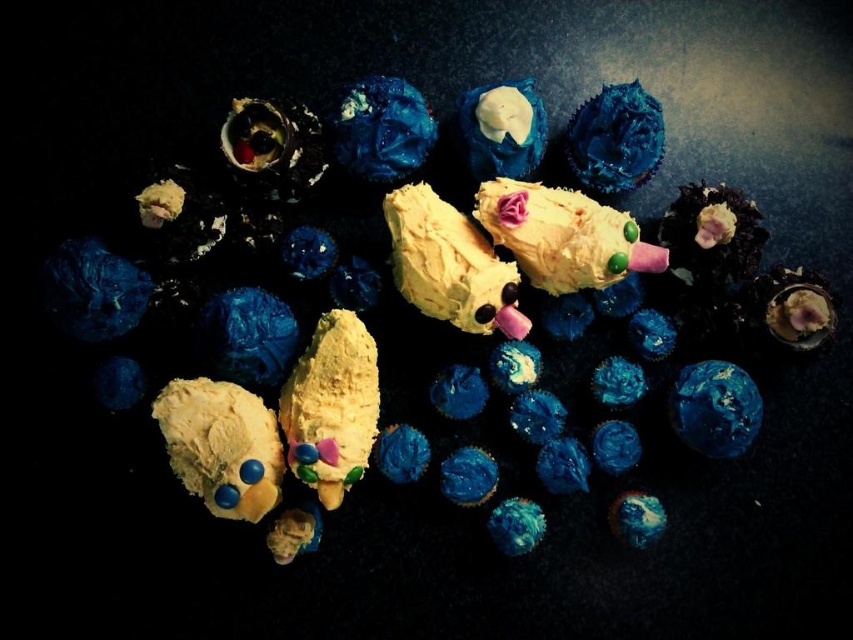
Question: Can you confirm if yellow matte ice cream cone at center is wider than satin blue cupcake at upper center?

Choices:
 (A) no
 (B) yes

Answer: (B)

Question: Can you confirm if yellow matte duckling at center is positioned to the right of matte blue cupcake at upper center?

Choices:
 (A) yes
 (B) no

Answer: (A)

Question: Which is farther from the smooth yellow cake pop at center?

Choices:
 (A) matte yellow plush toy at center
 (B) shiny metallic ring at upper left
 (C) satin blue cupcake at upper center
 (D) matte blue cupcake at center

Answer: (A)

Question: Among these objects, which one is nearest to the camera?

Choices:
 (A) yellow matte duckling at center
 (B) matte yellow duck at center

Answer: (B)

Question: Does yellow matte ice cream cone at center have a larger size compared to matte blue cupcake at upper center?

Choices:
 (A) no
 (B) yes

Answer: (B)

Question: Considering the real-world distances, which object is closest to the yellow matte duckling at center?

Choices:
 (A) matte blue cupcake at upper center
 (B) shiny metallic ring at upper left
 (C) smooth yellow cake pop at center
 (D) matte blue cupcake at center

Answer: (C)